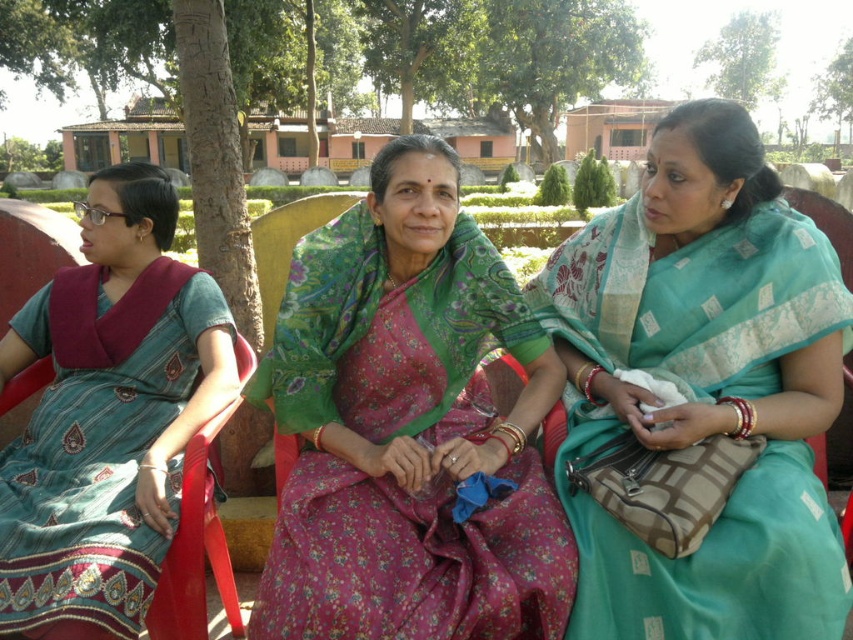
Is point (390, 298) farther from viewer compared to point (105, 196)?

No, it is not.

Between green floral saree at center and teal silk saree at left, which one is positioned lower?

Positioned lower is teal silk saree at left.

Identify the location of green floral saree at center. The image size is (853, 640). (407, 428).

Does green floral saree at center have a smaller size compared to teal silk saree at center?

Correct, green floral saree at center occupies less space than teal silk saree at center.

Does green floral saree at center appear on the left side of teal silk saree at center?

Correct, you'll find green floral saree at center to the left of teal silk saree at center.

I want to click on green floral saree at center, so click(x=407, y=428).

Image resolution: width=853 pixels, height=640 pixels. Identify the location of green floral saree at center. (407, 428).

Which is in front, point (666, 128) or point (158, 273)?

Point (666, 128) is more forward.

This screenshot has height=640, width=853. What do you see at coordinates (705, 385) in the screenshot?
I see `teal silk saree at center` at bounding box center [705, 385].

Find the location of `teal silk saree at center`. teal silk saree at center is located at coordinates (705, 385).